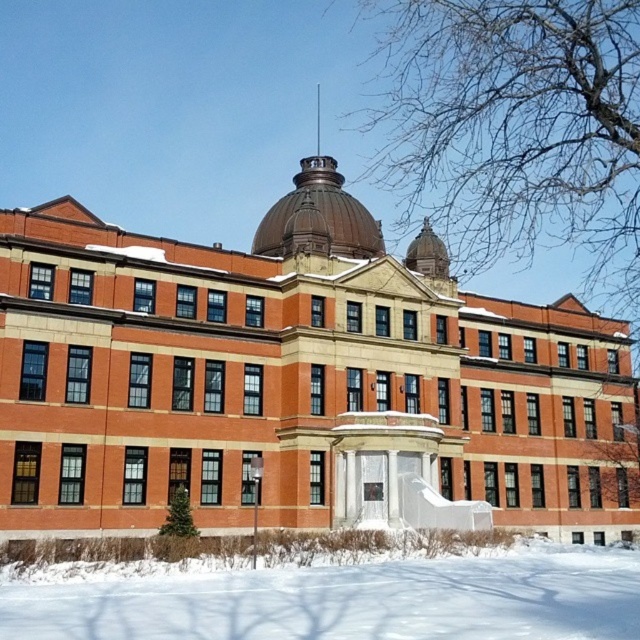
Does white powdery snow at lower center have a larger size compared to shiny brown dome at center?

No, white powdery snow at lower center is not bigger than shiny brown dome at center.

Who is more forward, (394,564) or (340,193)?

Point (394,564)

The width and height of the screenshot is (640, 640). Find the location of `white powdery snow at lower center`. white powdery snow at lower center is located at coordinates (337, 600).

You are a GUI agent. You are given a task and a screenshot of the screen. Output one action in this format:
    pyautogui.click(x=<x>, y=<y>)
    Task: Click on the white powdery snow at lower center
    The height and width of the screenshot is (640, 640).
    Given the screenshot: What is the action you would take?
    pyautogui.click(x=337, y=600)